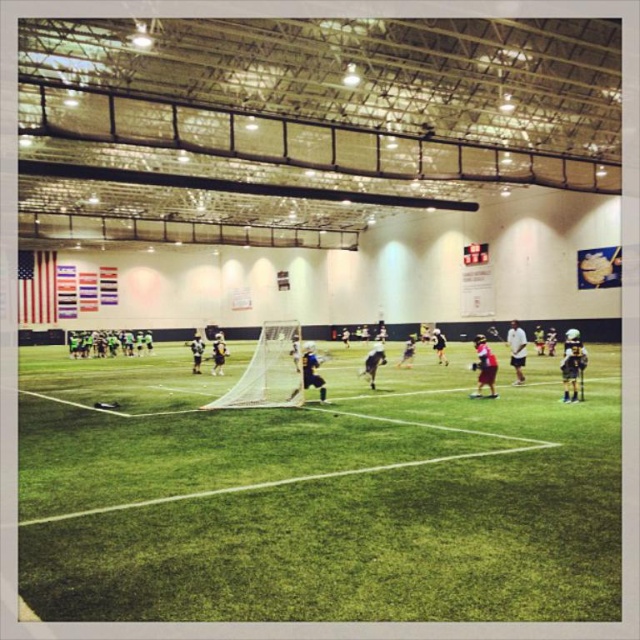
From the picture: Between green artificial turf at center and white mesh net at center, which one is positioned higher?

white mesh net at center is above.

Does green artificial turf at center appear on the right side of white mesh net at center?

Correct, you'll find green artificial turf at center to the right of white mesh net at center.

Between point (288, 518) and point (280, 353), which one is positioned behind?

Positioned behind is point (280, 353).

Identify the location of green artificial turf at center. The image size is (640, 640). (320, 497).